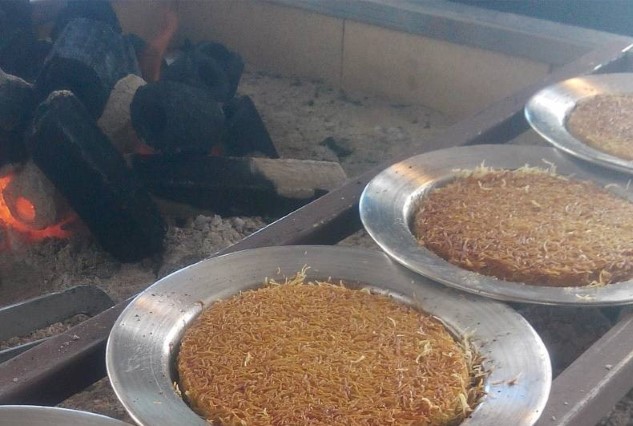
Image resolution: width=633 pixels, height=426 pixels. I want to click on plate 2, so click(404, 258).